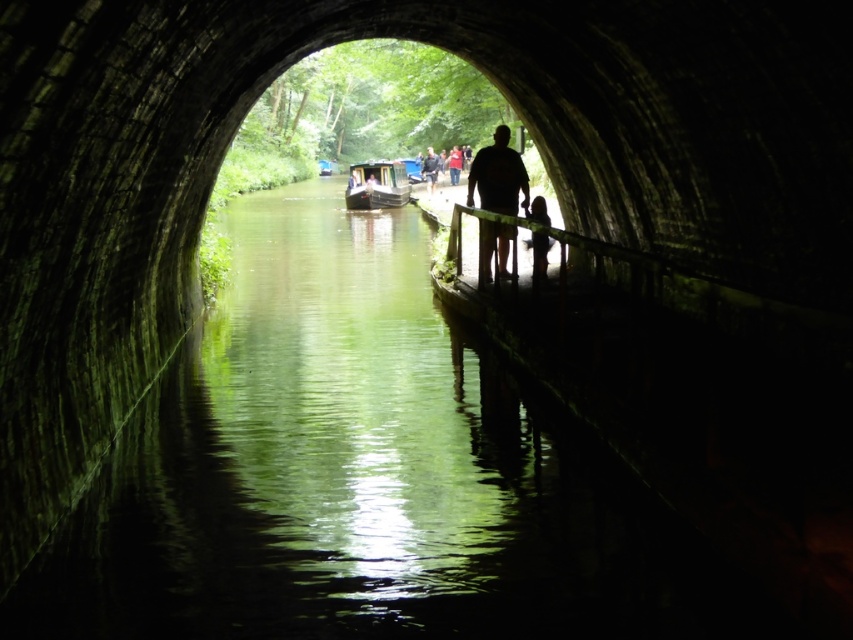
You are standing inside the dark arched tunnel and see the silhouette figure at center and the dark blue shirt at center through the opening. Which object is closer to the tunnel entrance?

The silhouette figure at center is closer to the tunnel entrance because it is located below the dark blue shirt at center, indicating it is positioned in front of it.